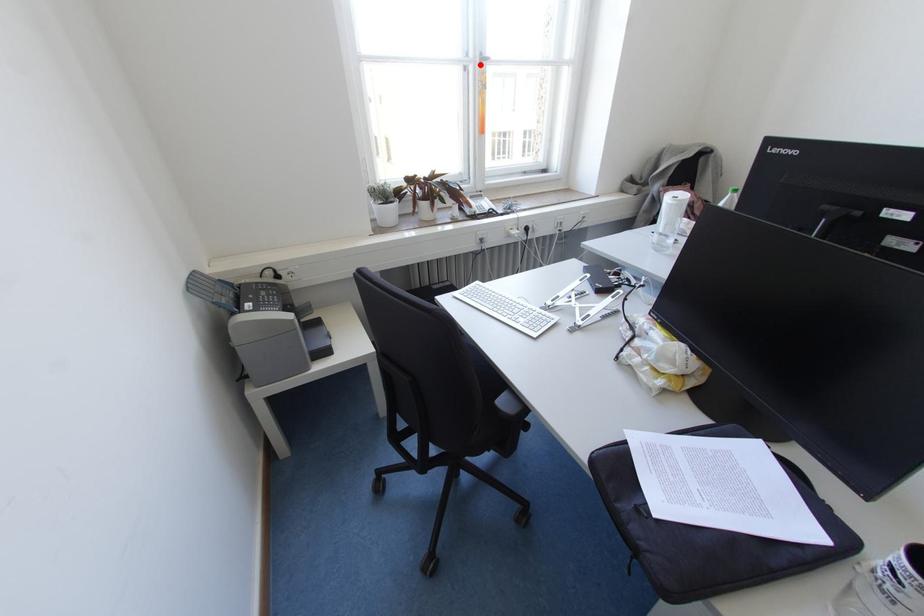
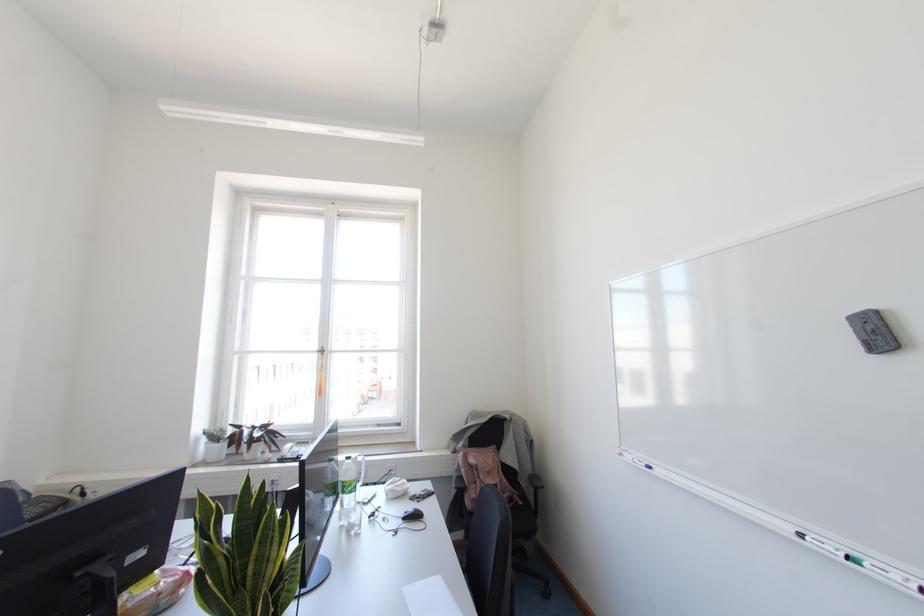
The point at the highlighted location is marked in the first image. Where is the corresponding point in the second image?

(322, 353)